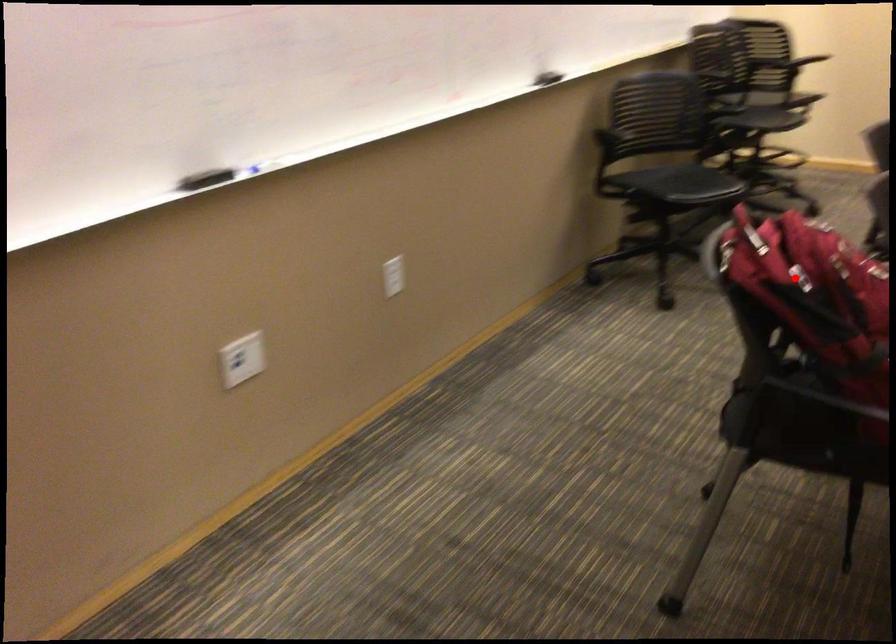
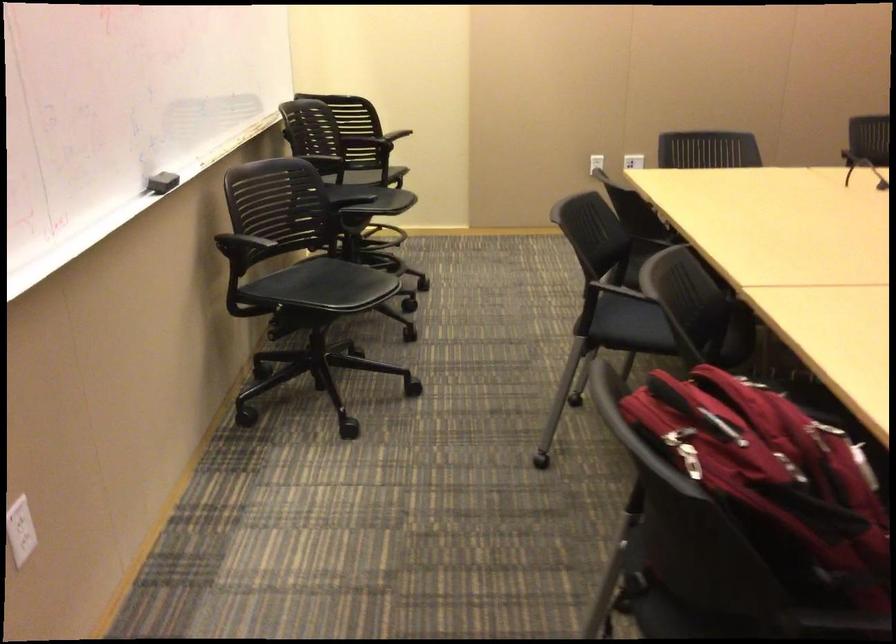
In the second image, find the point that corresponds to the highlighted location in the first image.

(773, 480)